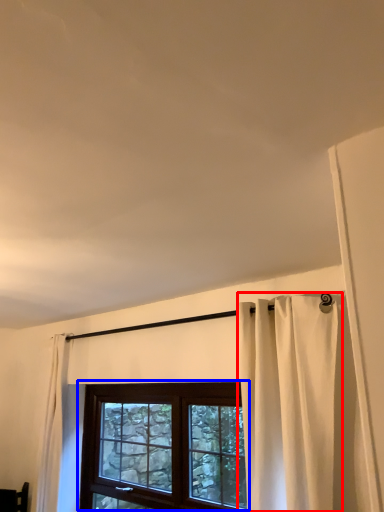
Question: Which object appears farthest to the camera in this image, curtain (highlighted by a red box) or window (highlighted by a blue box)?

Choices:
 (A) curtain
 (B) window

Answer: (B)